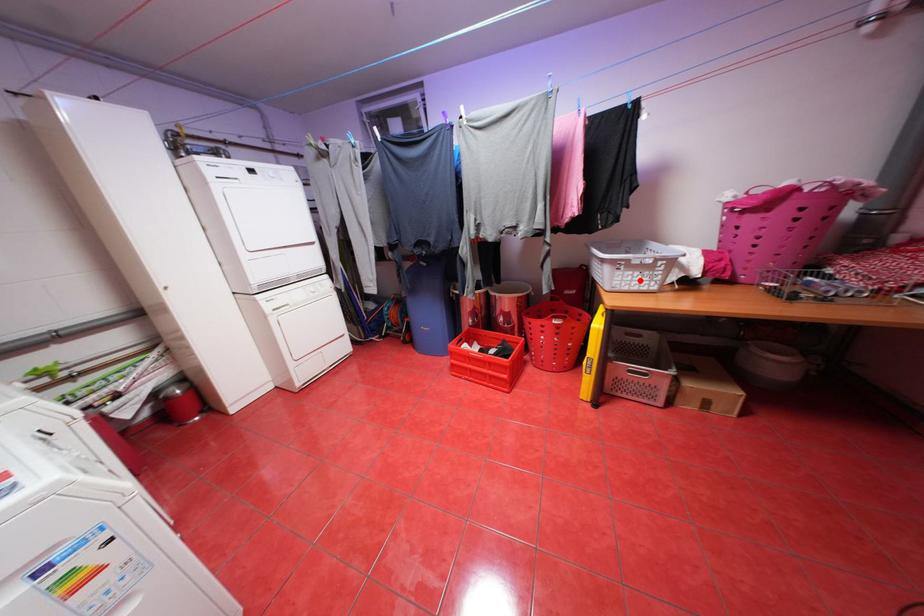
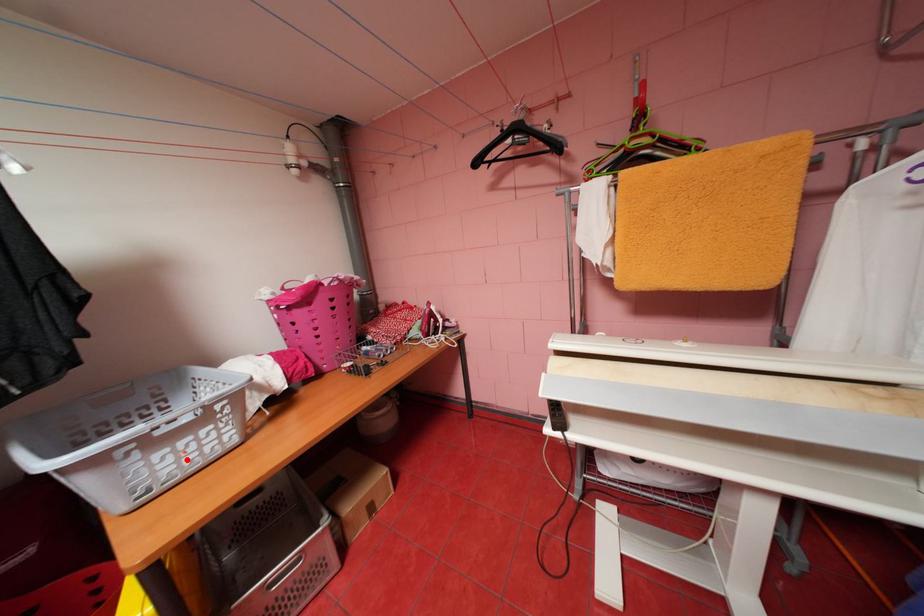
I am providing you with two images of the same scene from different viewpoints. A red point is marked on the first image and another point is marked on the second image. Is the marked point in image1 the same physical position as the marked point in image2?

Yes